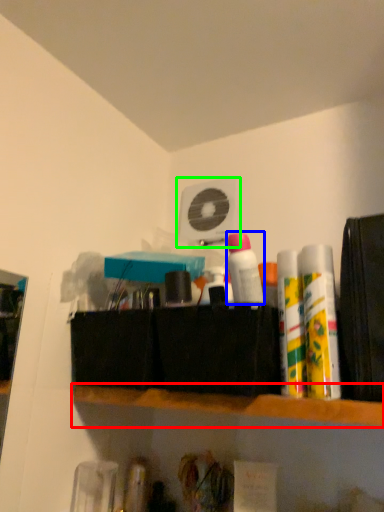
Question: Which object is positioned farthest from shelf (highlighted by a red box)? Select from toiletry (highlighted by a blue box) and fan (highlighted by a green box).

Choices:
 (A) toiletry
 (B) fan

Answer: (B)